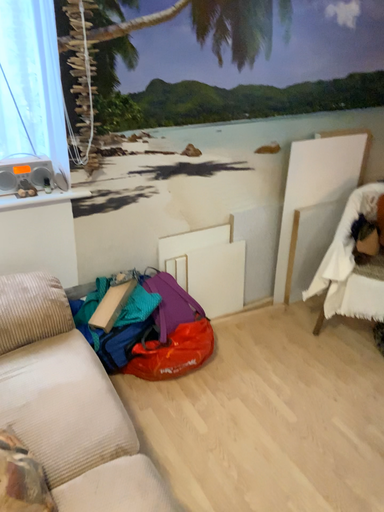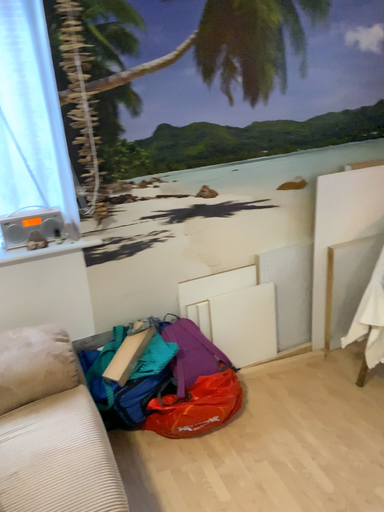
Question: Which way did the camera rotate in the video?

Choices:
 (A) rotated left
 (B) rotated right

Answer: (A)